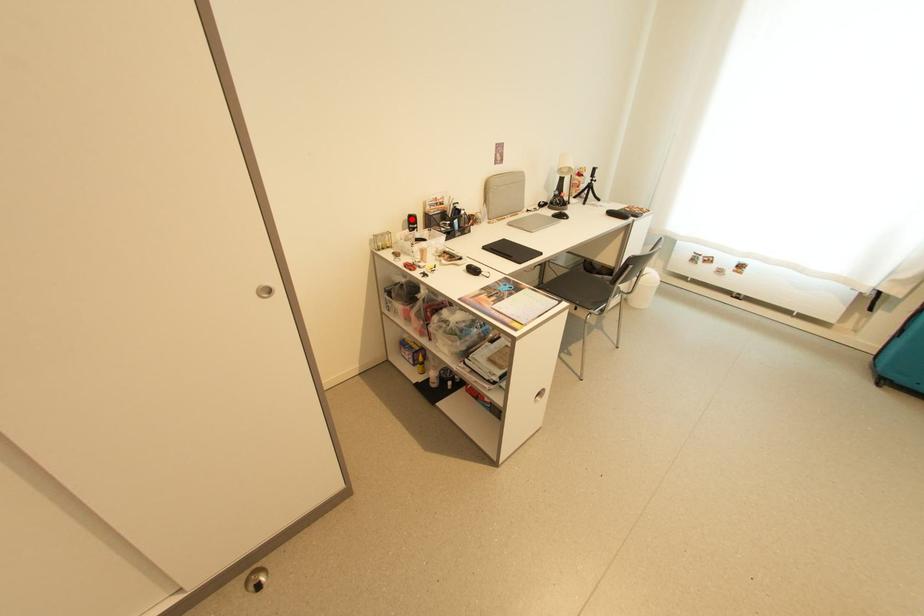
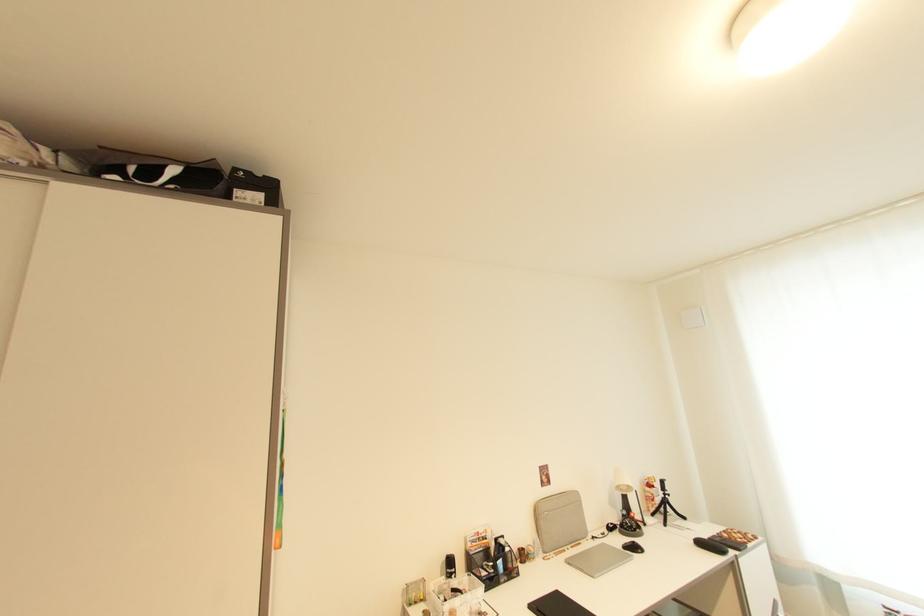
Question: I am providing you with two images of the same scene from different viewpoints. Given a red point in image1, look at the same physical point in image2. Is it:

Choices:
 (A) Closer to the viewpoint
 (B) Farther from the viewpoint

Answer: (B)